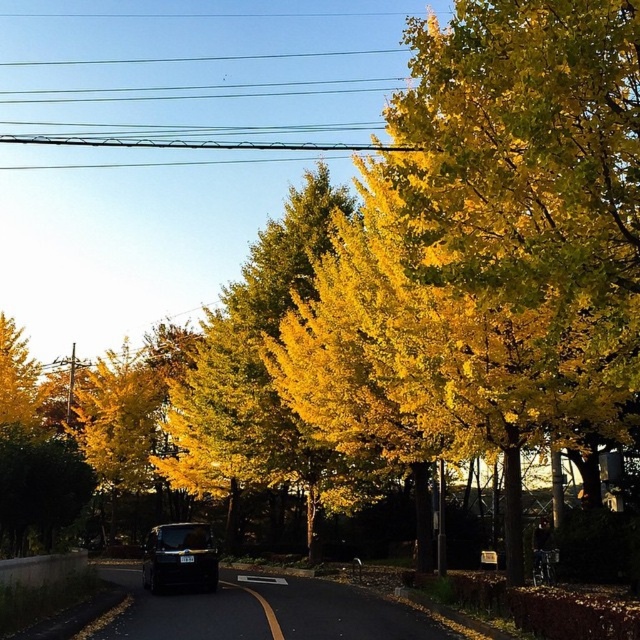
Question: Which point is farther to the camera?

Choices:
 (A) (266, 442)
 (B) (198, 534)

Answer: (A)

Question: Does yellow leafy tree at center come in front of shiny black van at center?

Choices:
 (A) no
 (B) yes

Answer: (A)

Question: Is the position of yellow leafy tree at center less distant than that of shiny black van at center?

Choices:
 (A) yes
 (B) no

Answer: (B)

Question: Can you confirm if yellow leafy tree at center is positioned above shiny black van at center?

Choices:
 (A) yes
 (B) no

Answer: (A)

Question: Which of the following is the closest to the observer?

Choices:
 (A) (192, 570)
 (B) (188, 428)

Answer: (A)

Question: Which point is closer to the camera?

Choices:
 (A) yellow leafy tree at center
 (B) shiny black van at center

Answer: (B)